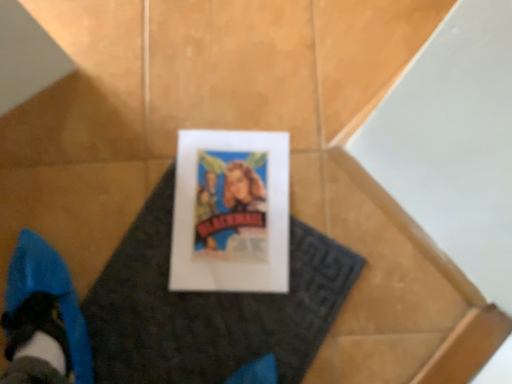
Identify the location of blank space situated above white paper at center (from a real-world perspective). (234, 207).